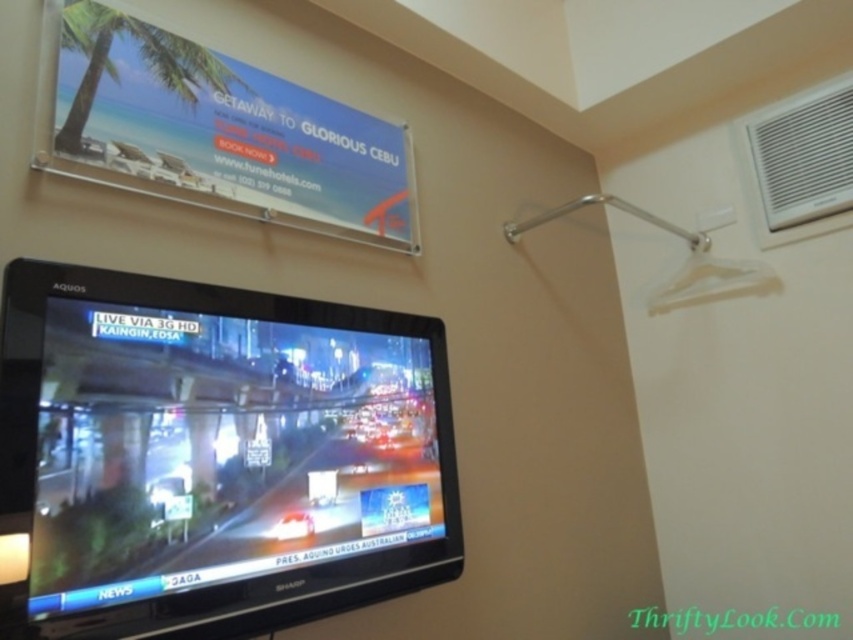
You are an interior designer assessing the room layout. You need to place a new decorative item that is the same size as the clear plastic hanger at upper right on the wall. Based on the black glossy tv at center, will the new item fit horizontally without overlapping the TV?

→ The black glossy tv at center is wider than the clear plastic hanger at upper right. Therefore, the new decorative item, which is the same size as the clear plastic hanger at upper right, will fit horizontally without overlapping the TV since it is narrower than the TV.

You are a delivery person who needs to place a large package on a shelf. The shelf has limited space. You see the black glossy tv at center and the clear plastic hanger at upper right. Which object takes up more space on the shelf?

The black glossy tv at center is bigger than the clear plastic hanger at upper right, so it takes up more space on the shelf.